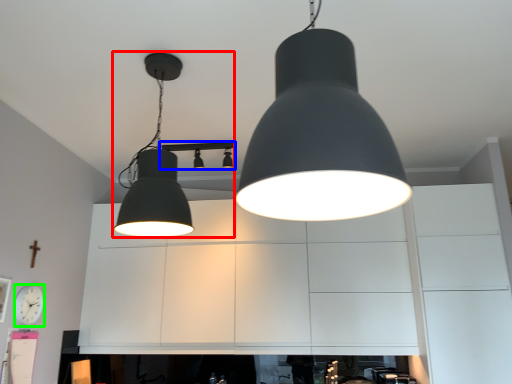
Question: Which is nearer to the lamp (highlighted by a red box)? lamp (highlighted by a blue box) or clock (highlighted by a green box).

Choices:
 (A) lamp
 (B) clock

Answer: (B)